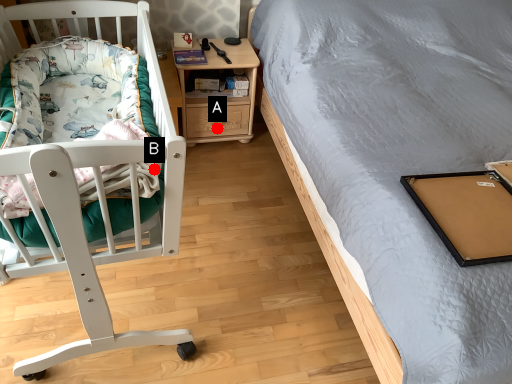
Question: Two points are circled on the image, labeled by A and B beside each circle. Which point is farther to the camera?

Choices:
 (A) A is further
 (B) B is further

Answer: (A)